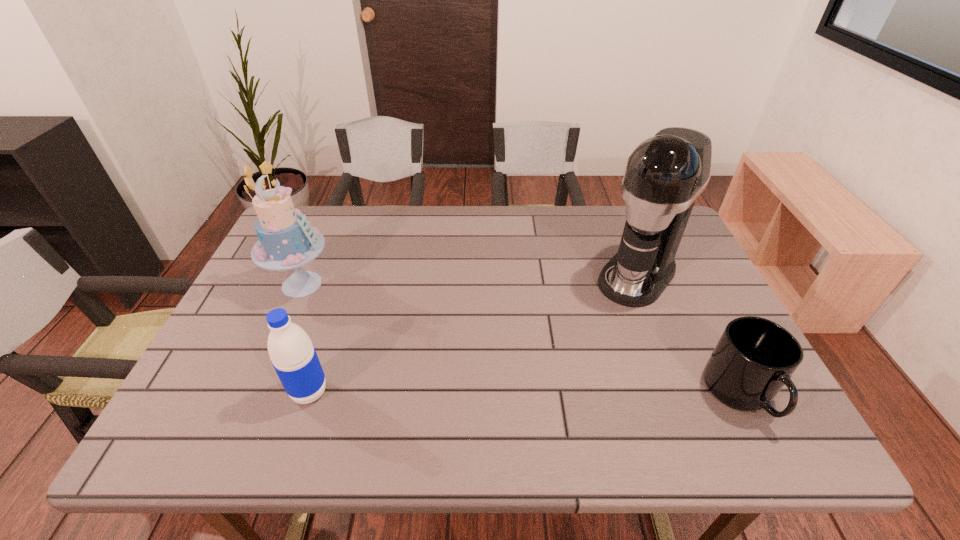
The image size is (960, 540). Identify the location of vacant spot on the desktop that is between the third tallest object and the shortest object and is positioned place cup under the spout of the coffee maker. (538, 393).

The height and width of the screenshot is (540, 960). Identify the location of vacant space on the desktop that is between the second shortest object and the shortest object and is positioned with a ladder on the side of the third shortest object. (493, 393).